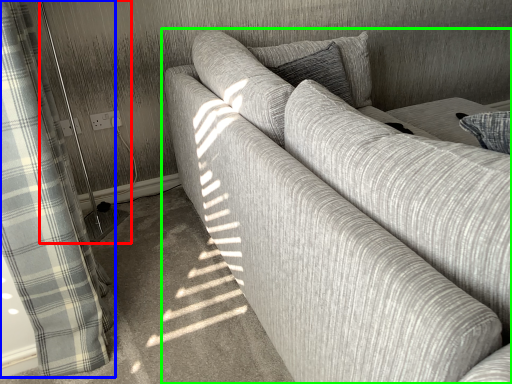
Question: Based on their relative distances, which object is farther from screen door (highlighted by a red box)? Choose from curtain (highlighted by a blue box) and studio couch (highlighted by a green box).

Choices:
 (A) curtain
 (B) studio couch

Answer: (B)